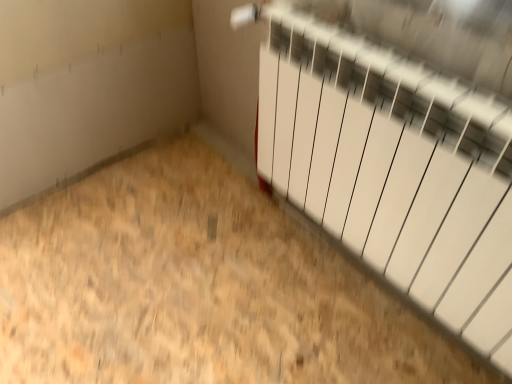
This screenshot has width=512, height=384. Find the location of `white matte radiator at right`. white matte radiator at right is located at coordinates (394, 170).

Describe the element at coordinates (394, 170) in the screenshot. Image resolution: width=512 pixels, height=384 pixels. I see `white matte radiator at right` at that location.

Image resolution: width=512 pixels, height=384 pixels. In order to click on white matte radiator at right in this screenshot , I will do `click(394, 170)`.